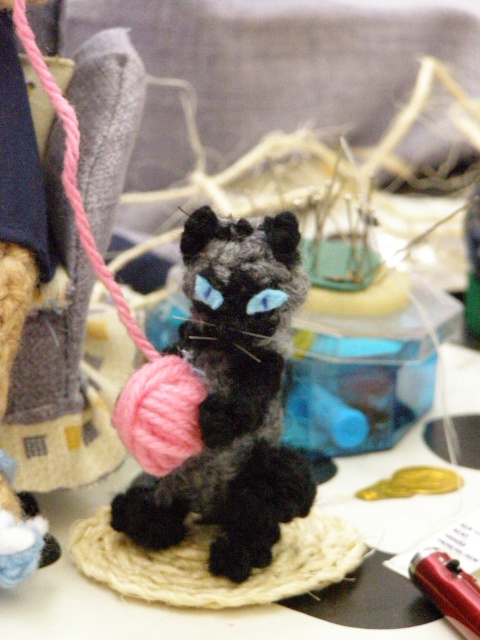
Which of these two, black yarn ball at center or red plastic pen at lower right, stands taller?

black yarn ball at center

Locate an element on the screen. This screenshot has width=480, height=640. black yarn ball at center is located at coordinates tap(231, 401).